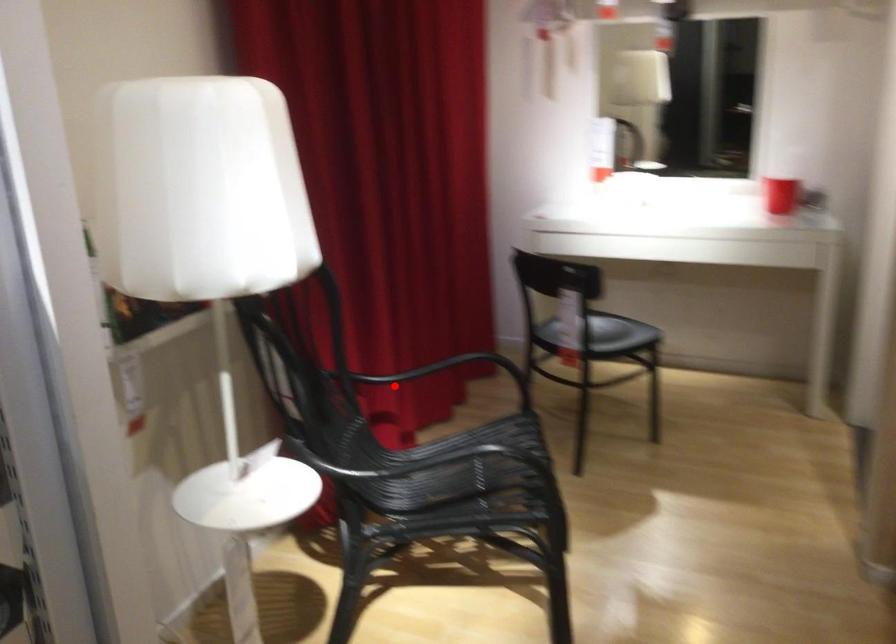
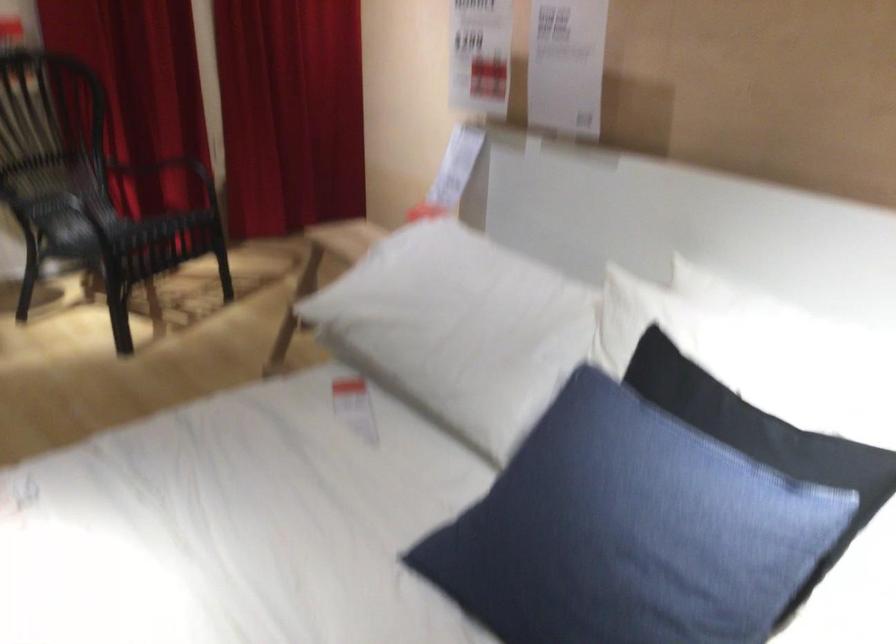
In the second image, find the point that corresponds to the highlighted location in the first image.

(176, 169)